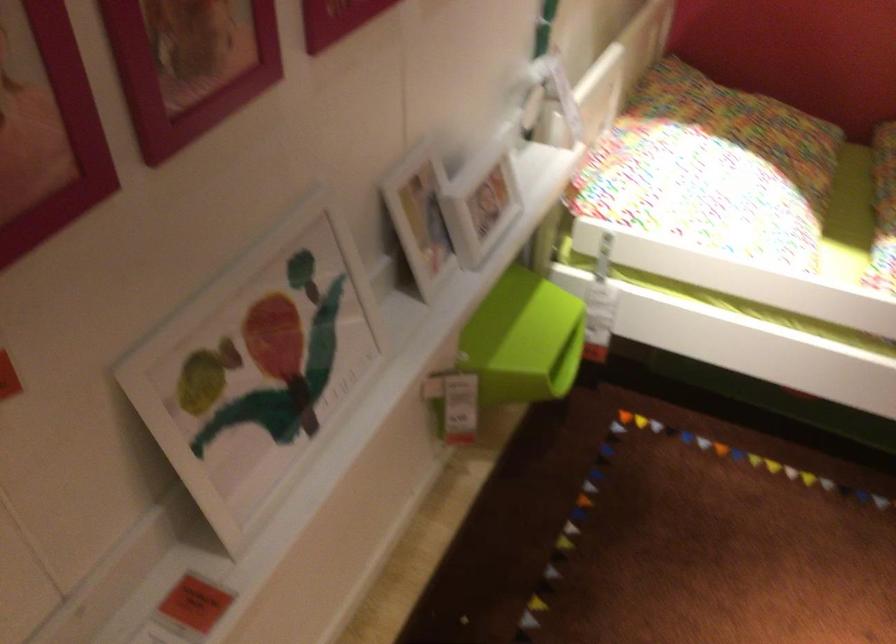
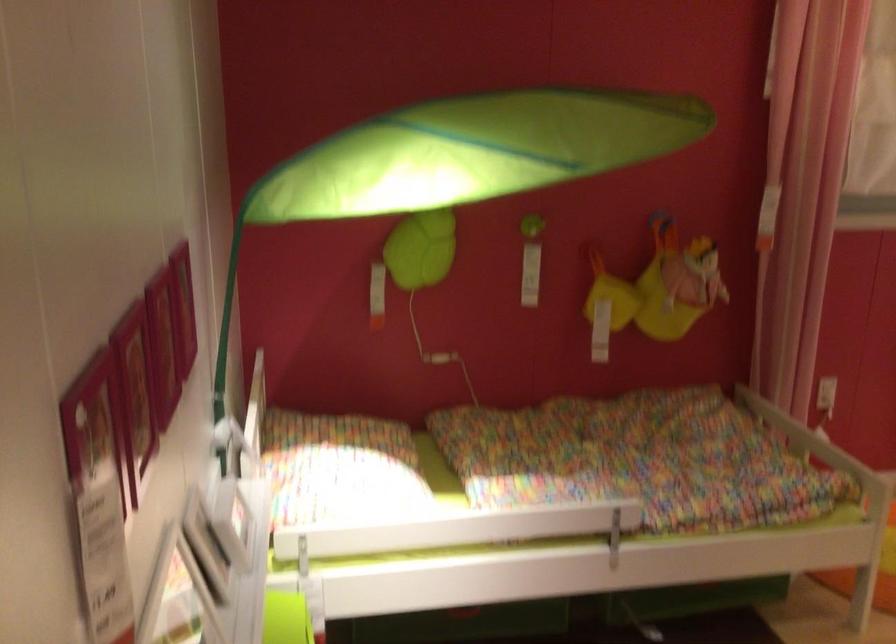
The point at (x=703, y=153) is marked in the first image. Where is the corresponding point in the second image?

(339, 468)